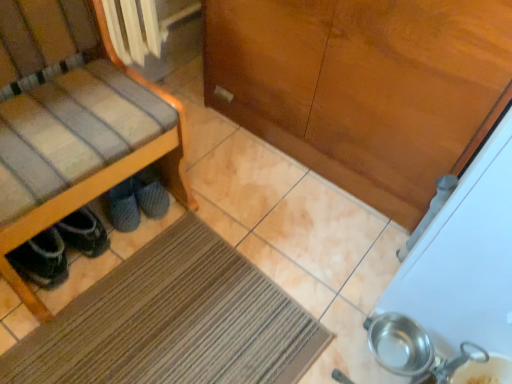
Where is `dark gray suede shoes under chair left, positioned as the first footwear in left-to-right order`? dark gray suede shoes under chair left, positioned as the first footwear in left-to-right order is located at coordinates (59, 248).

Measure the distance between point (160, 186) and camera.

Point (160, 186) is 4.75 feet from camera.

Describe the element at coordinates (173, 322) in the screenshot. I see `brown textured mat at lower center` at that location.

Identify the location of dark gray suede shoes under chair left, positioned as the first footwear in left-to-right order. (59, 248).

The height and width of the screenshot is (384, 512). I want to click on furniture above the brown textured mat at lower center (from the image's perspective), so click(74, 125).

Can you confirm if brown textured mat at lower center is wider than wooden chair at left?

Correct, the width of brown textured mat at lower center exceeds that of wooden chair at left.

Between brown textured mat at lower center and wooden chair at left, which one appears on the left side from the viewer's perspective?

Positioned to the left is wooden chair at left.

Can you confirm if brown textured mat at lower center is bigger than wooden chair at left?

No.

In terms of size, does wooden chair at left appear bigger or smaller than wooden cabinet at center?

In the image, wooden chair at left appears to be larger than wooden cabinet at center.

Is wooden cabinet at center at the back of wooden chair at left?

No, wooden chair at left's orientation is not away from wooden cabinet at center.

Consider the image. Which is correct: wooden chair at left is inside wooden cabinet at center, or outside of it?

wooden chair at left is located beyond the bounds of wooden cabinet at center.

Is point (63, 152) positioned after point (472, 25)?

Yes.

Considering the sizes of objects brown textured mat at lower center and wooden cabinet at center in the image provided, who is shorter, brown textured mat at lower center or wooden cabinet at center?

brown textured mat at lower center is shorter.

From the picture: From a real-world perspective, is brown textured mat at lower center positioned over wooden cabinet at center based on gravity?

No, from a real-world perspective, brown textured mat at lower center is not over wooden cabinet at center

Is brown textured mat at lower center looking in the opposite direction of wooden cabinet at center?

brown textured mat at lower center is not turned away from wooden cabinet at center.

Does brown textured mat at lower center come behind wooden cabinet at center?

No, brown textured mat at lower center is closer to the viewer.

Looking at this image, between gray fuzzy slippers at lower left, which is counted as the 1th footwear, starting from the right, and brown textured mat at lower center, which one has smaller width?

Thinner between the two is gray fuzzy slippers at lower left, which is counted as the 1th footwear, starting from the right.

From the image's perspective, which one is positioned lower, gray fuzzy slippers at lower left, which is the 2th footwear from front to back, or brown textured mat at lower center?

brown textured mat at lower center appears lower in the image.

At what (x,y) coordinates should I click in order to perform the action: click on mat that appears in front of the gray fuzzy slippers at lower left, which is counted as the 1th footwear, starting from the right. Please return your answer as a coordinate pair (x, y). This screenshot has height=384, width=512. Looking at the image, I should click on (173, 322).

Is wooden cabinet at center smaller than gray fuzzy slippers at lower left, which is the 2th footwear from left to right?

Incorrect, wooden cabinet at center is not smaller in size than gray fuzzy slippers at lower left, which is the 2th footwear from left to right.

Can you confirm if wooden cabinet at center is taller than gray fuzzy slippers at lower left, which is the 2th footwear from left to right?

Yes, wooden cabinet at center is taller than gray fuzzy slippers at lower left, which is the 2th footwear from left to right.

Is wooden cabinet at center to the left or to the right of gray fuzzy slippers at lower left, which is the 2th footwear from left to right, in the image?

wooden cabinet at center is to the right of gray fuzzy slippers at lower left, which is the 2th footwear from left to right.

Considering the relative sizes of gray fuzzy slippers at lower left, which is the 2th footwear from left to right, and wooden chair at left in the image provided, is gray fuzzy slippers at lower left, which is the 2th footwear from left to right, thinner than wooden chair at left?

Yes, gray fuzzy slippers at lower left, which is the 2th footwear from left to right, is thinner than wooden chair at left.

Image resolution: width=512 pixels, height=384 pixels. I want to click on furniture in front of the gray fuzzy slippers at lower left, which is counted as the 1th footwear, starting from the right, so click(x=74, y=125).

Considering the sizes of gray fuzzy slippers at lower left, which is counted as the 1th footwear, starting from the right, and wooden chair at left in the image, is gray fuzzy slippers at lower left, which is counted as the 1th footwear, starting from the right, taller or shorter than wooden chair at left?

Clearly, gray fuzzy slippers at lower left, which is counted as the 1th footwear, starting from the right, is shorter compared to wooden chair at left.

Can you confirm if gray fuzzy slippers at lower left, which is the 1th footwear in back-to-front order, is bigger than wooden chair at left?

No.

Is gray fuzzy slippers at lower left, which is the 1th footwear in back-to-front order, wider or thinner than wooden cabinet at center?

In the image, gray fuzzy slippers at lower left, which is the 1th footwear in back-to-front order, appears to be wider than wooden cabinet at center.

Is gray fuzzy slippers at lower left, which is counted as the 1th footwear, starting from the right, inside or outside of wooden cabinet at center?

gray fuzzy slippers at lower left, which is counted as the 1th footwear, starting from the right, is located beyond the bounds of wooden cabinet at center.

Which is in front, point (125, 180) or point (360, 113)?

Positioned in front is point (360, 113).

Between gray fuzzy slippers at lower left, which is the 2th footwear from front to back, and wooden cabinet at center, which one has less height?

With less height is gray fuzzy slippers at lower left, which is the 2th footwear from front to back.

Identify the location of furniture that is above the brown textured mat at lower center (from a real-world perspective). (74, 125).

At what (x,y) coordinates should I click in order to perform the action: click on cabinetry behind the wooden chair at left. Please return your answer as a coordinate pair (x, y). The height and width of the screenshot is (384, 512). Looking at the image, I should click on (364, 86).

When comparing their distances from brown textured mat at lower center, does wooden chair at left or gray fuzzy slippers at lower left, which is the 2th footwear from front to back, seem further?

Among the two, wooden chair at left is located further to brown textured mat at lower center.

Estimate the real-world distances between objects in this image. Which object is closer to wooden chair at left, dark gray suede shoes under chair left, positioned as the first footwear in left-to-right order, or brown textured mat at lower center?

The object closer to wooden chair at left is dark gray suede shoes under chair left, positioned as the first footwear in left-to-right order.

Which object lies further to the anchor point wooden chair at left, dark gray suede shoes under chair left, acting as the 2th footwear starting from the back, or wooden cabinet at center?

Based on the image, wooden cabinet at center appears to be further to wooden chair at left.

From the image, which object appears to be farther from dark gray suede shoes under chair left, arranged as the first footwear when viewed from the front, wooden cabinet at center or gray fuzzy slippers at lower left, which is the 2th footwear from left to right?

Based on the image, wooden cabinet at center appears to be further to dark gray suede shoes under chair left, arranged as the first footwear when viewed from the front.

Considering their positions, is gray fuzzy slippers at lower left, which is the 1th footwear in back-to-front order, positioned closer to brown textured mat at lower center than wooden chair at left?

Among the two, gray fuzzy slippers at lower left, which is the 1th footwear in back-to-front order, is located nearer to brown textured mat at lower center.

Looking at the image, which one is located closer to gray fuzzy slippers at lower left, which is the 2th footwear from front to back, dark gray suede shoes under chair left, arranged as the first footwear when viewed from the front, or wooden cabinet at center?

dark gray suede shoes under chair left, arranged as the first footwear when viewed from the front.

Looking at the image, which one is located further to dark gray suede shoes under chair left, arranged as the first footwear when viewed from the front, brown textured mat at lower center or wooden cabinet at center?

The object further to dark gray suede shoes under chair left, arranged as the first footwear when viewed from the front, is wooden cabinet at center.

Which object lies further to the anchor point wooden cabinet at center, wooden chair at left or gray fuzzy slippers at lower left, which is counted as the 1th footwear, starting from the right?

Among the two, gray fuzzy slippers at lower left, which is counted as the 1th footwear, starting from the right, is located further to wooden cabinet at center.

At what (x,y) coordinates should I click in order to perform the action: click on furniture between wooden cabinet at center and brown textured mat at lower center in the up-down direction. Please return your answer as a coordinate pair (x, y). Looking at the image, I should click on (74, 125).

Identify the location of footwear located between wooden chair at left and gray fuzzy slippers at lower left, which is the 2th footwear from front to back, in the depth direction. The height and width of the screenshot is (384, 512). (59, 248).

Where is `furniture between dark gray suede shoes under chair left, acting as the 2th footwear starting from the back, and wooden cabinet at center`? The image size is (512, 384). furniture between dark gray suede shoes under chair left, acting as the 2th footwear starting from the back, and wooden cabinet at center is located at coordinates pos(74,125).

This screenshot has width=512, height=384. I want to click on footwear between dark gray suede shoes under chair left, which ranks as the 2th footwear in right-to-left order, and wooden cabinet at center from left to right, so click(136, 200).